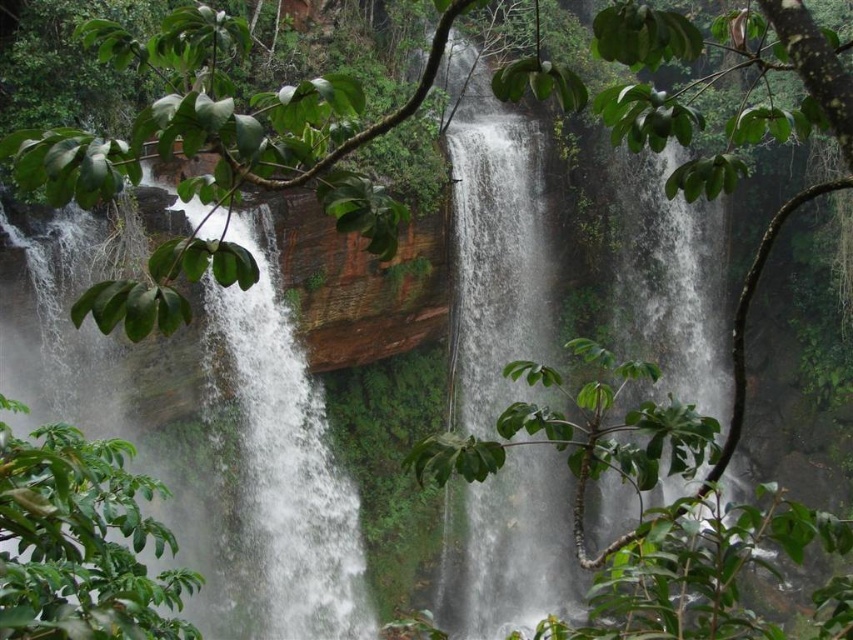
Question: Can you confirm if white frothy water at center is bigger than green leafy tree at lower left?

Choices:
 (A) yes
 (B) no

Answer: (A)

Question: Does white frothy water at center have a smaller size compared to green leafy tree at lower left?

Choices:
 (A) yes
 (B) no

Answer: (B)

Question: Does white frothy water at center appear on the right side of green leafy tree at lower left?

Choices:
 (A) yes
 (B) no

Answer: (A)

Question: Which point is farther to the camera?

Choices:
 (A) (18, 500)
 (B) (465, 563)

Answer: (B)